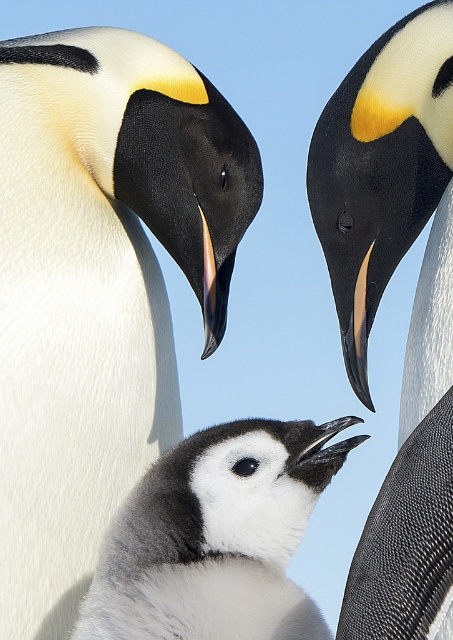
Question: Does white matte penguin at center lie behind soft gray down at center?

Choices:
 (A) yes
 (B) no

Answer: (A)

Question: Can you confirm if white matte penguin at center is bigger than soft gray down at center?

Choices:
 (A) yes
 (B) no

Answer: (A)

Question: Which point appears closest to the camera in this image?

Choices:
 (A) (433, 77)
 (B) (59, 413)
 (C) (170, 564)

Answer: (C)

Question: Which of the following is the farthest from the observer?

Choices:
 (A) white matte penguin at center
 (B) soft gray down at center
 (C) white fluffy penguin chick at center

Answer: (C)

Question: From the image, what is the correct spatial relationship of white matte penguin at center in relation to soft gray down at center?

Choices:
 (A) above
 (B) below

Answer: (A)

Question: Which of these objects is positioned farthest from the white fluffy penguin chick at center?

Choices:
 (A) white matte penguin at center
 (B) soft gray down at center

Answer: (B)